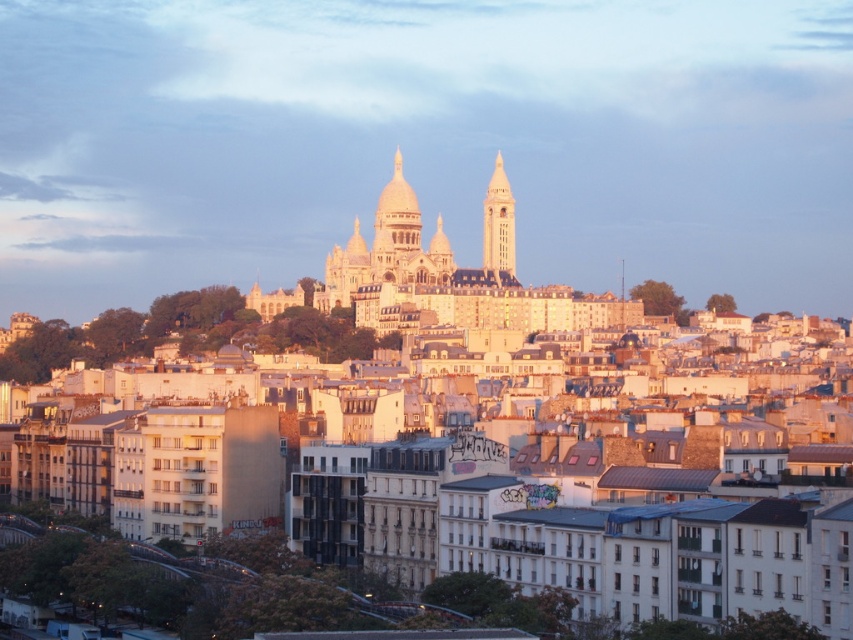
You are a tourist standing at the base of Montmartre hill looking up at the Sacre Coeur basilica. You notice two white stone structures in the distance. Which of the two, the white stone dome at center or the white stone tower at upper center, appears bigger to you?

The white stone dome at center appears bigger than the white stone tower at upper center because it is larger in size according to the description.

Based on the coordinates provided, what architectural feature is located at point (395, 228) in the image?

The point (395, 228) corresponds to the white stone dome at center.

You are standing at the base of Montmartre hill and looking up at the Basilica of the Sacred Heart. Which structure, the white stone dome at center or the white stone tower at upper center, would appear larger to you due to its proximity?

The white stone dome at center appears larger because it is closer to the viewer than the white stone tower at upper center.